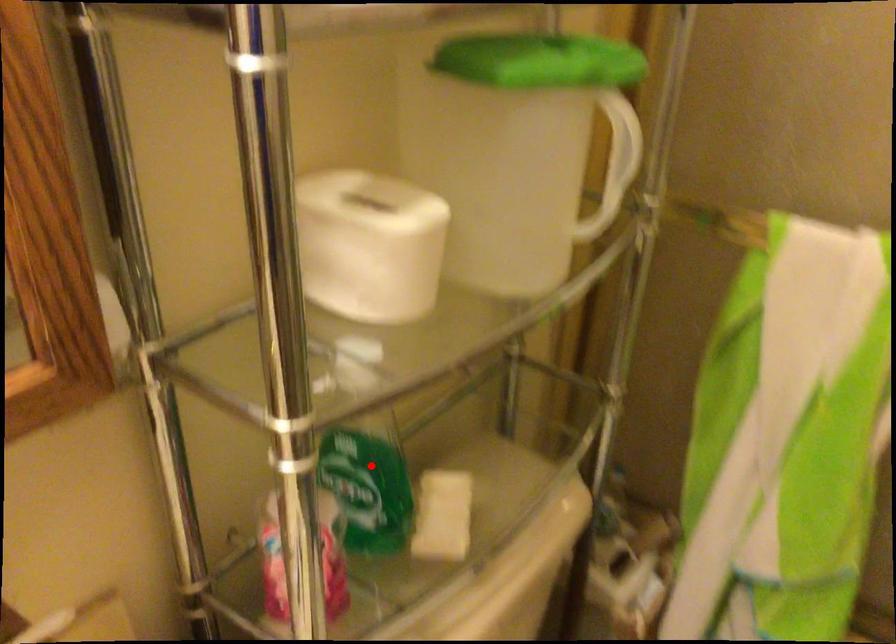
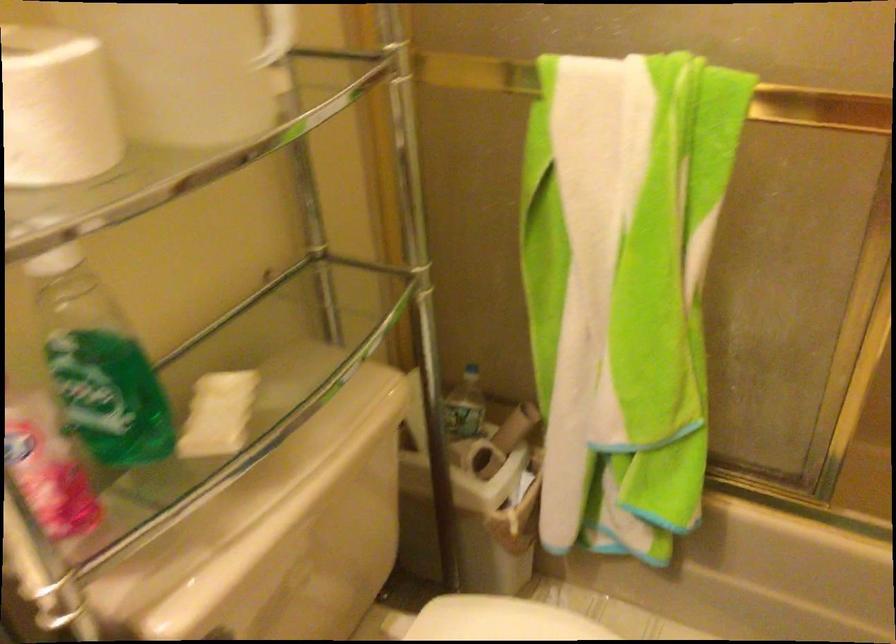
Question: I am providing you with two images of the same scene from different viewpoints. A red point is marked on the first image. Can you still see the location of the red point in image 2?

Choices:
 (A) Yes
 (B) No

Answer: (A)